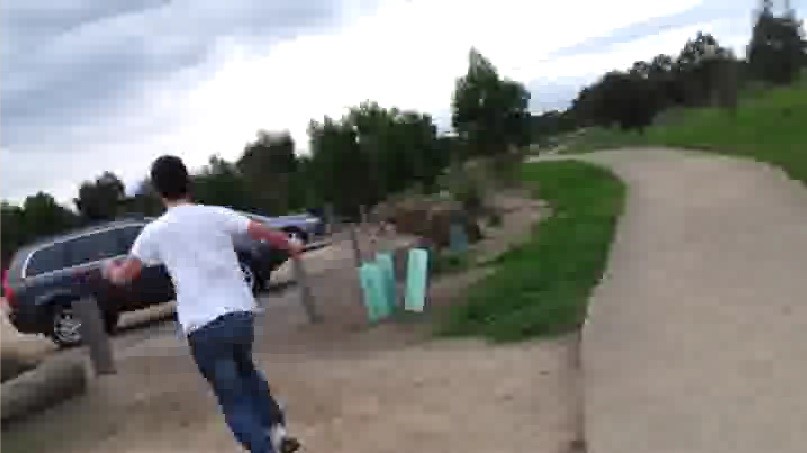
The width and height of the screenshot is (807, 453). What are the coordinates of `electrical boxes` in the screenshot? It's located at (370, 272), (378, 256), (408, 273).